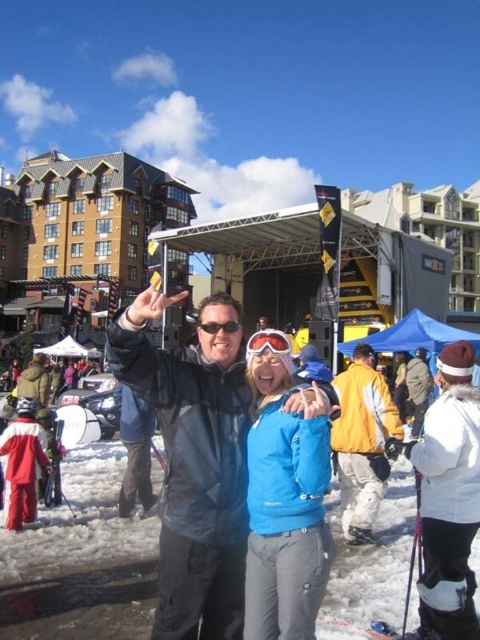
Question: Which object is positioned farthest from the matte black jacket at center?

Choices:
 (A) matte black goggles at center
 (B) yellow matte jacket at center

Answer: (B)

Question: Can you confirm if blue softshell jacket at center is positioned to the right of yellow matte jacket at center?

Choices:
 (A) yes
 (B) no

Answer: (B)

Question: Based on their relative distances, which object is farther from the blue softshell jacket at center?

Choices:
 (A) matte black jacket at center
 (B) yellow matte jacket at center

Answer: (B)

Question: Is blue softshell jacket at center wider than yellow matte jacket at center?

Choices:
 (A) yes
 (B) no

Answer: (B)

Question: Is matte black jacket at center to the right of transparent plastic goggles at center from the viewer's perspective?

Choices:
 (A) no
 (B) yes

Answer: (A)

Question: Among these objects, which one is farthest from the camera?

Choices:
 (A) matte black goggles at center
 (B) transparent plastic goggles at center

Answer: (A)